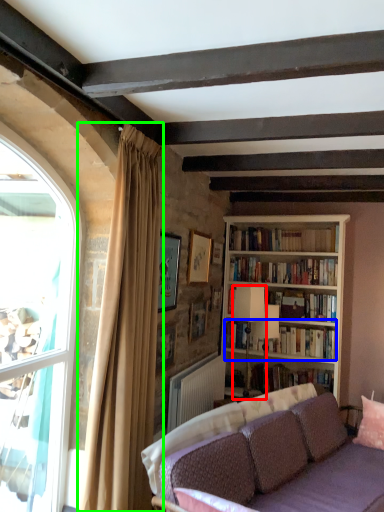
Question: Estimate the real-world distances between objects in this image. Which object is closer to lamp (highlighted by a red box), book (highlighted by a blue box) or curtain (highlighted by a green box)?

Choices:
 (A) book
 (B) curtain

Answer: (A)